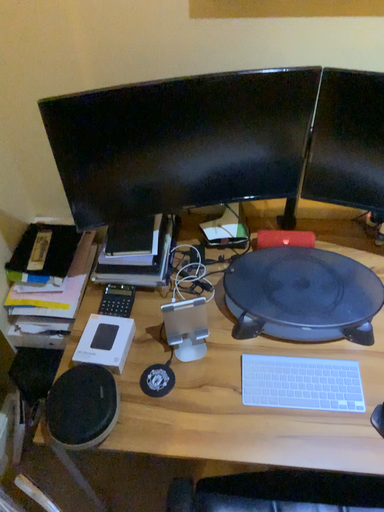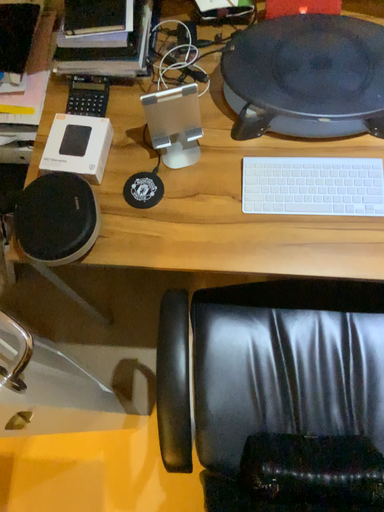
Question: Which way did the camera rotate in the video?

Choices:
 (A) rotated downward
 (B) rotated upward

Answer: (A)